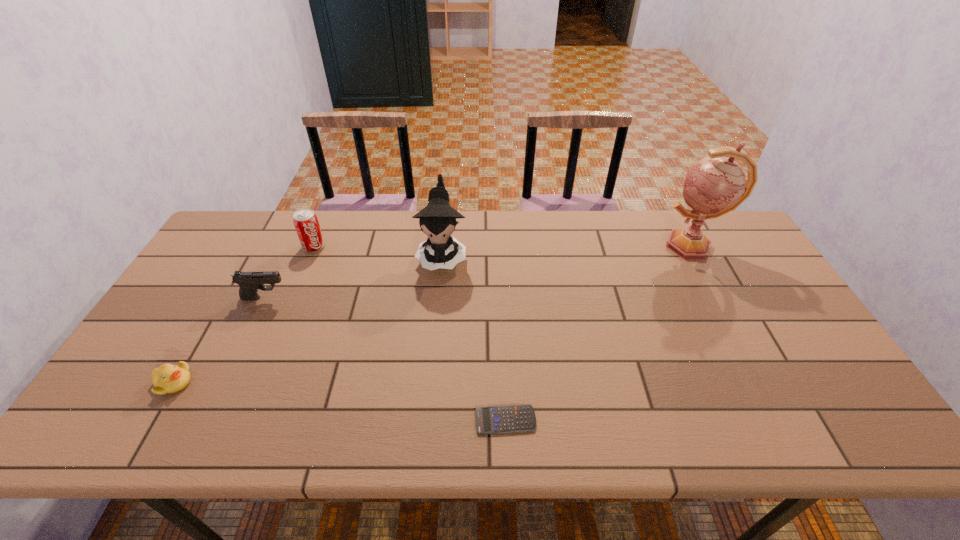
You are a GUI agent. You are given a task and a screenshot of the screen. Output one action in this format:
    pyautogui.click(x=<x>, y=<y>)
    Task: Click on the tallest object
    The image size is (960, 540).
    Given the screenshot: What is the action you would take?
    pyautogui.click(x=715, y=185)

Identify the location of globe. (715, 185).

What are the coordinates of `the third object from right to left` in the screenshot? It's located at (438, 219).

Identify the location of doll. This screenshot has width=960, height=540. (438, 219).

I want to click on the third tallest object, so click(x=306, y=223).

This screenshot has width=960, height=540. Find the location of `pistol`. pistol is located at coordinates (249, 282).

The width and height of the screenshot is (960, 540). Identify the location of the third shortest object. (249, 282).

I want to click on the leftmost object, so click(x=168, y=378).

At what (x,y) coordinates should I click in order to perform the action: click on the second nearest object. Please return your answer as a coordinate pair (x, y). The width and height of the screenshot is (960, 540). Looking at the image, I should click on (168, 378).

At what (x,y) coordinates should I click in order to perform the action: click on the fifth object from left to right. Please return your answer as a coordinate pair (x, y). The height and width of the screenshot is (540, 960). Looking at the image, I should click on (502, 419).